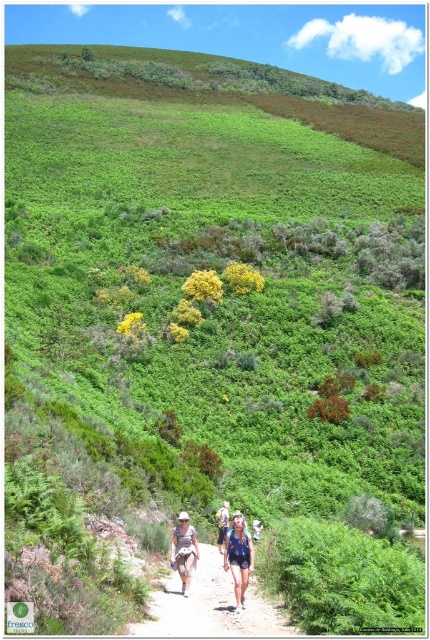
Question: Which of the following is the farthest from the observer?

Choices:
 (A) blue denim shorts at center
 (B) denim shorts at center
 (C) brown dirt path at center
 (D) camouflage fabric shorts at center

Answer: (A)

Question: Considering the relative positions of brown dirt path at center and camouflage fabric shorts at center in the image provided, where is brown dirt path at center located with respect to camouflage fabric shorts at center?

Choices:
 (A) below
 (B) above

Answer: (A)

Question: Is denim shorts at center below blue denim shorts at center?

Choices:
 (A) yes
 (B) no

Answer: (B)

Question: Does brown dirt path at center appear over denim shorts at center?

Choices:
 (A) no
 (B) yes

Answer: (A)

Question: Which object appears closest to the camera in this image?

Choices:
 (A) camouflage fabric shorts at center
 (B) brown dirt path at center
 (C) blue denim shorts at center
 (D) denim shorts at center

Answer: (B)

Question: Among these points, which one is farthest from the camera?

Choices:
 (A) (178, 561)
 (B) (249, 611)
 (C) (221, 502)

Answer: (C)